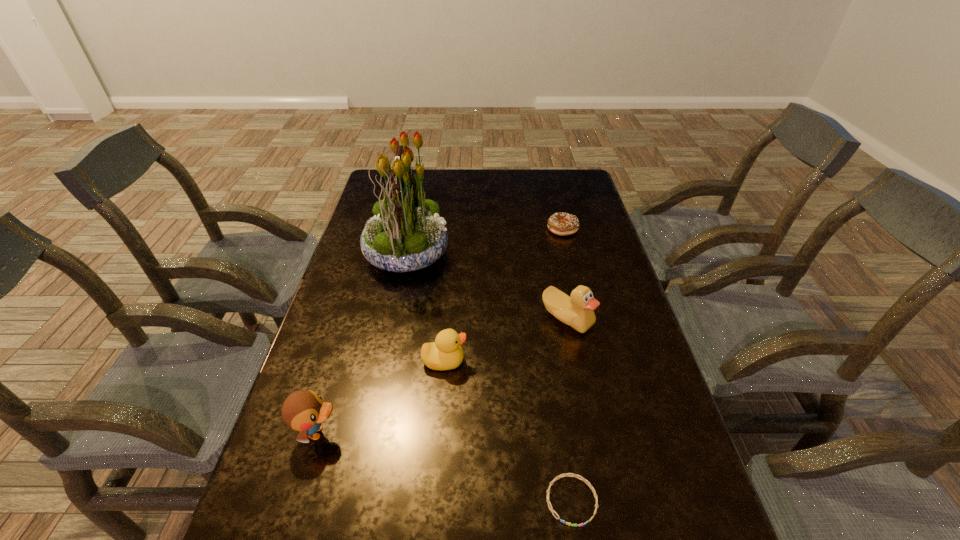
Locate an element on the screen. The image size is (960, 540). vacant space located on the front-facing side of the tallest object is located at coordinates (483, 253).

Where is `vacant space located 0.370m at the beak of the farthest duck`? Image resolution: width=960 pixels, height=540 pixels. vacant space located 0.370m at the beak of the farthest duck is located at coordinates (599, 476).

This screenshot has width=960, height=540. I want to click on free space located on the front-facing side of the second nearest object, so click(437, 433).

Locate an element on the screen. free region located at the beak of the shortest duck is located at coordinates (586, 361).

I want to click on free space located on the front of the doughnut, so click(568, 253).

This screenshot has width=960, height=540. Identify the location of flower arrangement at the left edge. (406, 234).

What are the coordinates of `duck situated at the left edge` in the screenshot? It's located at (304, 410).

Where is `duck at the right edge`? duck at the right edge is located at coordinates (577, 311).

Where is `doughnut that is positioned at the right edge`? The width and height of the screenshot is (960, 540). doughnut that is positioned at the right edge is located at coordinates (560, 223).

I want to click on free space at the far edge, so [491, 181].